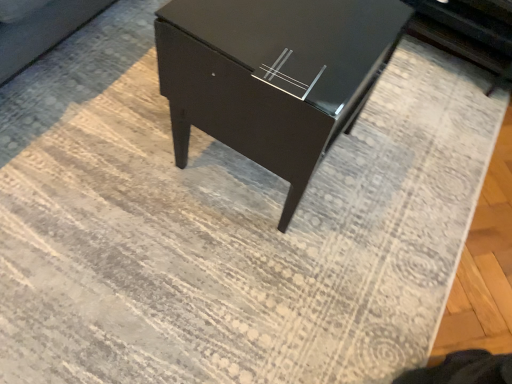
The image size is (512, 384). What are the coordinates of `glossy black table at center` in the screenshot? It's located at (274, 75).

What do you see at coordinates (274, 75) in the screenshot? I see `glossy black table at center` at bounding box center [274, 75].

In order to click on glossy black table at center in this screenshot , I will do `click(274, 75)`.